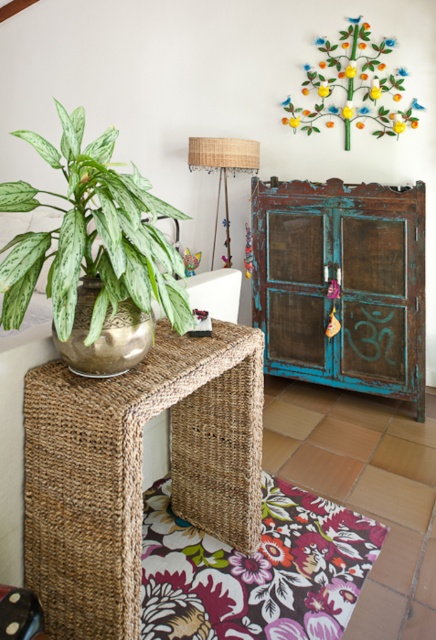
You are arranging a small decorative item on the woven seagrass side table at lower left and want to ensure it doesn not block the view of the green variegated leaf at left. Given their heights, will the item placed on the table obscure the leaf?

The woven seagrass side table at lower left is taller than the green variegated leaf at left. If the decorative item is placed on the table, its height could potentially block the view of the leaf depending on its size, but since the table itself is already taller, the leaf might still be visible unless the item is significantly taller than the table.

You are arranging a small decorative item on the table. The metallic green tree at upper right and the woven fabric lampshade at center are already placed. Which object has more space around it for placing the new item?

The woven fabric lampshade at center has more space around it because the metallic green tree at upper right occupies less space than the woven fabric lampshade at center.

You are planning to move the metallic green tree at upper right and the woven fabric lampshade at center to a new shelf. The shelf is 1.2 meters wide. Can both items fit side by side on the shelf without overlapping?

The metallic green tree at upper right might be wider than woven fabric lampshade at center. Since the shelf is 1.2 meters wide, it depends on their combined widths. If the total width of both items is less than or equal to 1.2 meters, they can fit. However, since the exact widths aren